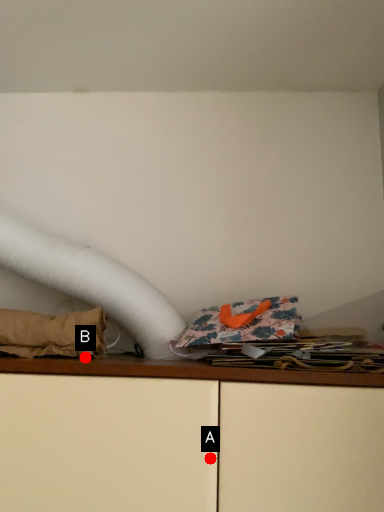
Question: Two points are circled on the image, labeled by A and B beside each circle. Which point is further to the camera?

Choices:
 (A) A is further
 (B) B is further

Answer: (B)